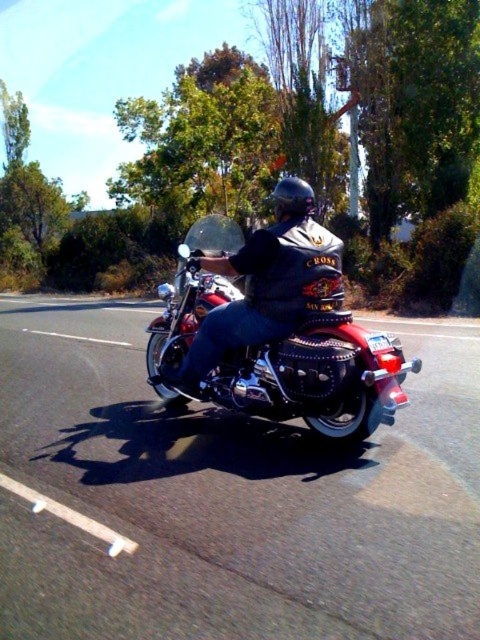
Is metallic chrome motorcycle at center thinner than black leather jacket at center?

Incorrect, metallic chrome motorcycle at center's width is not less than black leather jacket at center's.

Is metallic chrome motorcycle at center positioned before black leather jacket at center?

Yes, metallic chrome motorcycle at center is closer to the viewer.

Describe the element at coordinates (240, 493) in the screenshot. I see `metallic chrome motorcycle at center` at that location.

You are a GUI agent. You are given a task and a screenshot of the screen. Output one action in this format:
    pyautogui.click(x=<x>, y=<y>)
    Task: Click on the metallic chrome motorcycle at center
    The image size is (480, 640).
    Given the screenshot: What is the action you would take?
    pyautogui.click(x=240, y=493)

Which of these two, shiny chrome motorcycle at center or black leather jacket at center, stands shorter?

shiny chrome motorcycle at center is shorter.

Does shiny chrome motorcycle at center have a lesser width compared to black leather jacket at center?

Incorrect, shiny chrome motorcycle at center's width is not less than black leather jacket at center's.

This screenshot has width=480, height=640. What do you see at coordinates (316, 364) in the screenshot?
I see `shiny chrome motorcycle at center` at bounding box center [316, 364].

I want to click on shiny chrome motorcycle at center, so click(x=316, y=364).

You are a GUI agent. You are given a task and a screenshot of the screen. Output one action in this format:
    pyautogui.click(x=<x>, y=<y>)
    Task: Click on the metallic chrome motorcycle at center
    Image resolution: width=480 pixels, height=640 pixels.
    Given the screenshot: What is the action you would take?
    pyautogui.click(x=240, y=493)

Which is in front, point (189, 532) or point (310, 326)?

Point (189, 532) is in front.

You are a GUI agent. You are given a task and a screenshot of the screen. Output one action in this format:
    pyautogui.click(x=<x>, y=<y>)
    Task: Click on the metallic chrome motorcycle at center
    
    Given the screenshot: What is the action you would take?
    pyautogui.click(x=240, y=493)